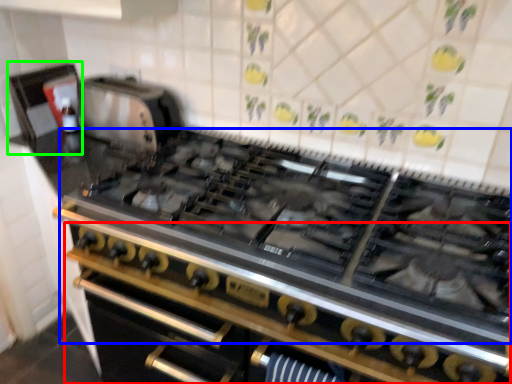
Question: Based on their relative distances, which object is farther from oven (highlighted by a red box)? Choose from gas stove (highlighted by a blue box) and appliance (highlighted by a green box).

Choices:
 (A) gas stove
 (B) appliance

Answer: (B)